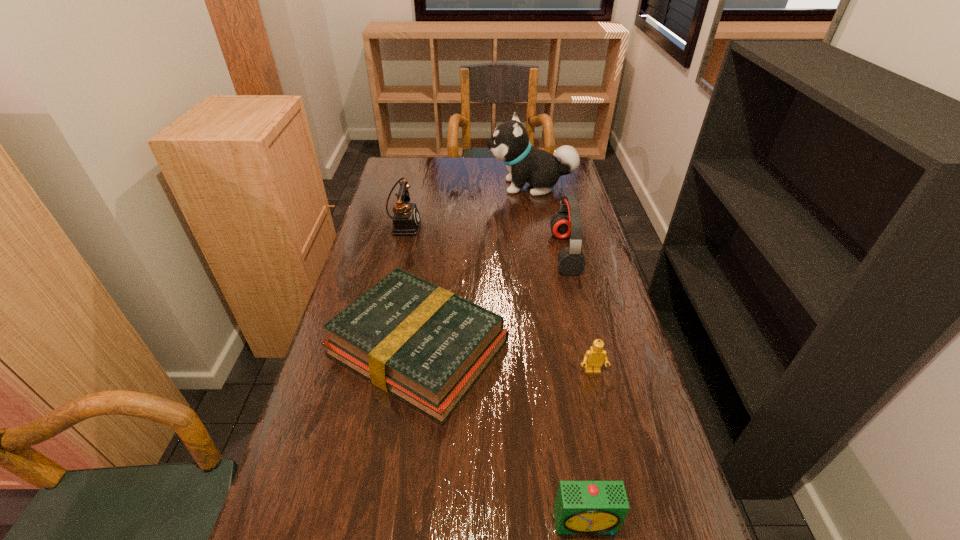
Locate an element on the screen. This screenshot has height=540, width=960. free space located 0.190m on the ear cups of the earphone is located at coordinates (493, 253).

Locate an element on the screen. This screenshot has width=960, height=540. vacant space situated on the ear cups of the earphone is located at coordinates (468, 253).

Identify the location of free space located on the ear cups of the earphone. This screenshot has width=960, height=540. (528, 253).

In order to click on free location located 0.210m on the front of the telephone at the rotary dial in this screenshot , I will do point(482,225).

Image resolution: width=960 pixels, height=540 pixels. I want to click on free space located on the face of the Lego, so click(x=612, y=454).

Find the location of a particular element. The height and width of the screenshot is (540, 960). vacant region located on the front of the hardback book is located at coordinates pyautogui.click(x=400, y=482).

The image size is (960, 540). In order to click on object located at the far edge in this screenshot , I will do `click(509, 143)`.

Image resolution: width=960 pixels, height=540 pixels. I want to click on telephone situated at the left edge, so click(406, 219).

Identify the location of hardback book situated at the left edge. (421, 343).

Where is `puppy that is at the right edge`? puppy that is at the right edge is located at coordinates (x=509, y=143).